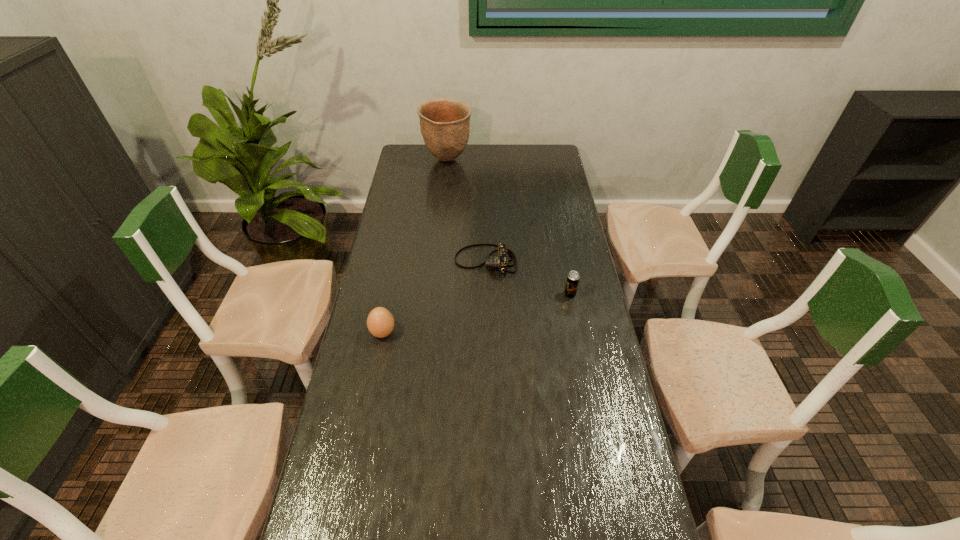
Where is `the tallest object`? Image resolution: width=960 pixels, height=540 pixels. the tallest object is located at coordinates (445, 123).

Where is `pottery`? This screenshot has height=540, width=960. pottery is located at coordinates (445, 123).

The image size is (960, 540). What are the coordinates of `the nearest object` in the screenshot? It's located at (380, 322).

Where is `beer can`? This screenshot has width=960, height=540. beer can is located at coordinates (573, 277).

This screenshot has height=540, width=960. In order to click on the third farthest object in this screenshot , I will do `click(573, 277)`.

This screenshot has width=960, height=540. I want to click on the shortest object, so click(500, 261).

At what (x,y) coordinates should I click in order to perform the action: click on the second farthest object. Please return your answer as a coordinate pair (x, y). The height and width of the screenshot is (540, 960). Looking at the image, I should click on (500, 261).

The image size is (960, 540). Identify the location of vacant space located 0.340m on the right of the tallest object. (541, 160).

Where is `vacant space situated 0.340m on the front of the nearest object`? Image resolution: width=960 pixels, height=540 pixels. vacant space situated 0.340m on the front of the nearest object is located at coordinates (360, 449).

In order to click on free space located 0.230m on the back of the second nearest object in this screenshot , I will do `click(561, 247)`.